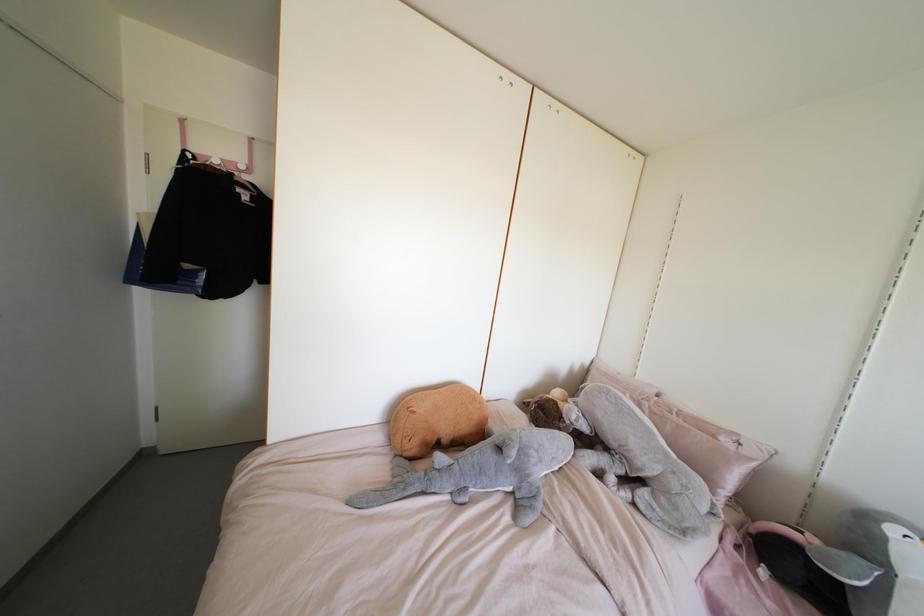
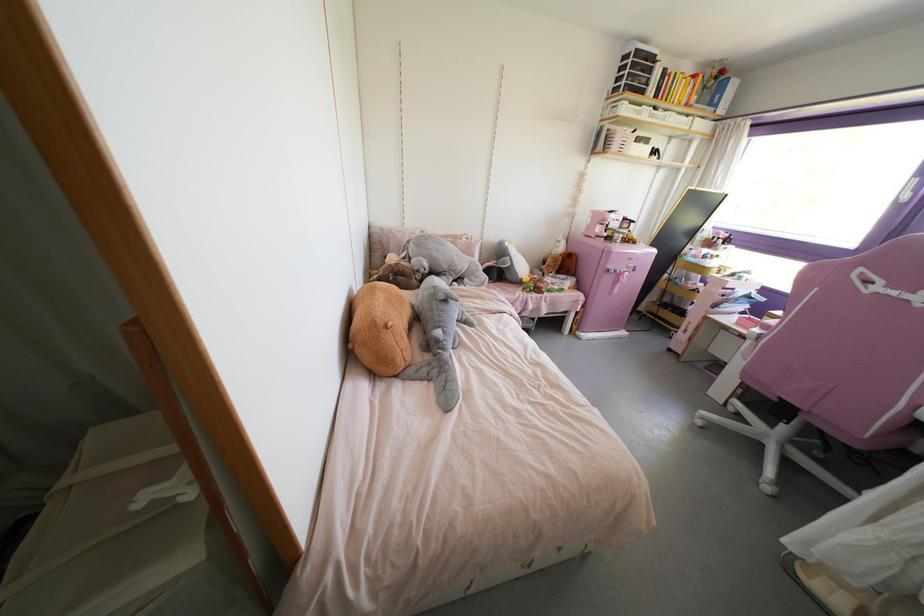
In the second image, find the point that corresponds to point 683,532 in the first image.

(482, 284)